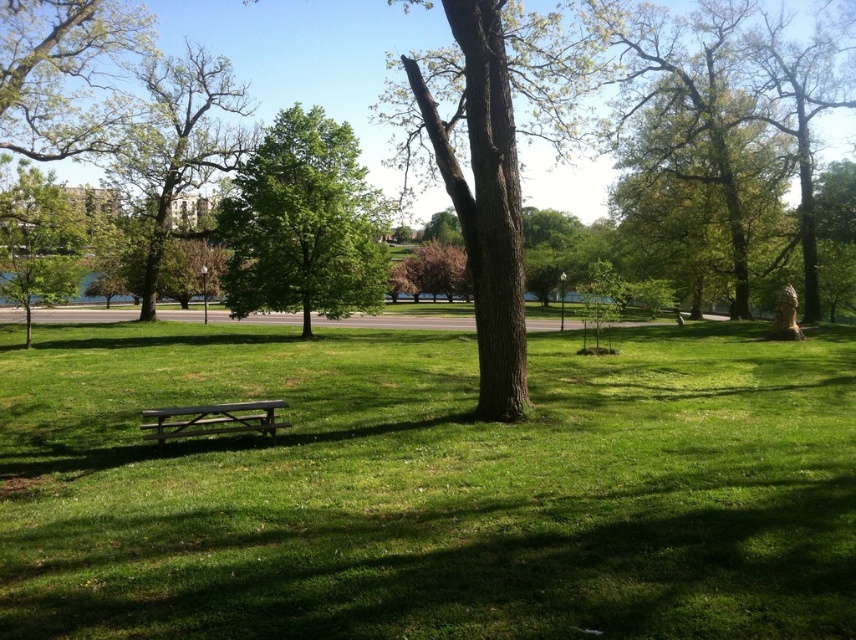
Question: Is green grassy at center thinner than green leafy tree at left?

Choices:
 (A) yes
 (B) no

Answer: (B)

Question: Is brown rough bark tree at center to the left of wooden picnic table at center from the viewer's perspective?

Choices:
 (A) yes
 (B) no

Answer: (B)

Question: Considering the real-world distances, which object is farthest from the green leafy tree at upper left?

Choices:
 (A) wooden picnic table at center
 (B) green grassy at center
 (C) green leafy tree at left
 (D) green leafy tree at center

Answer: (A)

Question: Which object is closer to the camera taking this photo?

Choices:
 (A) wooden picnic table at center
 (B) brown rough bark tree at center

Answer: (A)

Question: In this image, where is green grassy at center located relative to wooden picnic table at center?

Choices:
 (A) above
 (B) below

Answer: (A)

Question: Which is nearer to the wooden picnic table at center?

Choices:
 (A) green leafy tree at upper left
 (B) green leafy tree at left

Answer: (B)